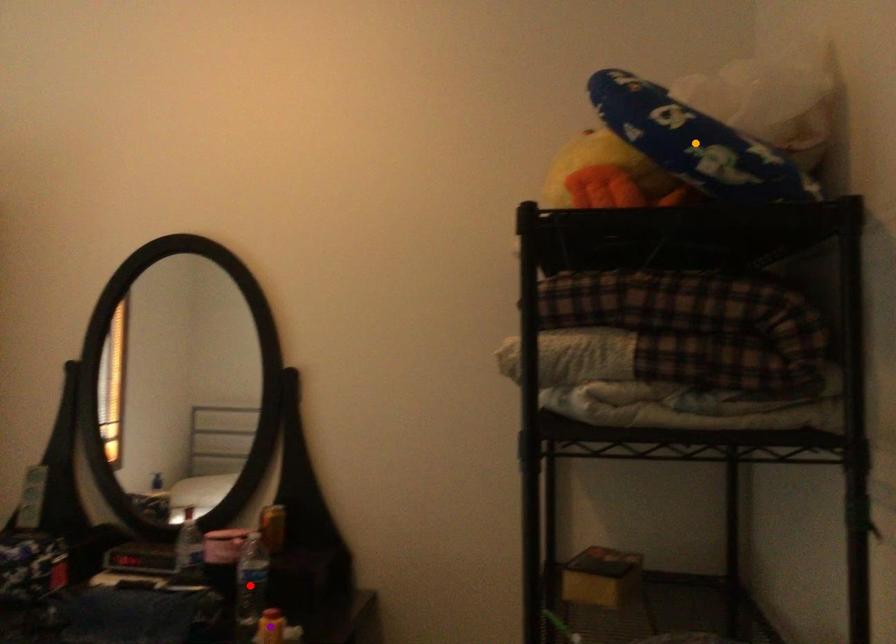
From the picture: Order these from nearest to farthest:
red point | orange point | purple point

orange point
purple point
red point